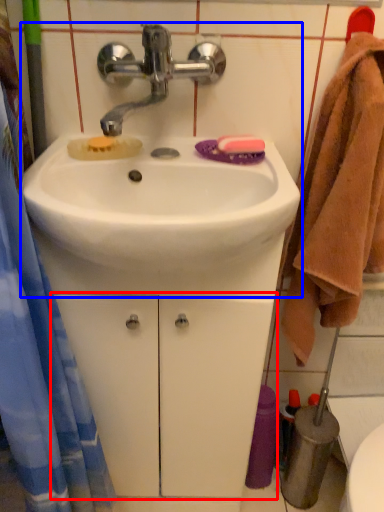
Question: Which object is further to the camera taking this photo, drawer (highlighted by a red box) or sink (highlighted by a blue box)?

Choices:
 (A) drawer
 (B) sink

Answer: (A)